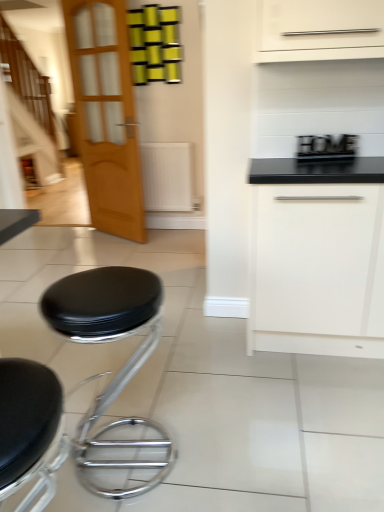
Locate an element on the screen. light brown wooden door at left is located at coordinates coord(106,115).

What do you see at coordinates (106, 115) in the screenshot? I see `light brown wooden door at left` at bounding box center [106, 115].

At what (x,y) coordinates should I click in order to perform the action: click on black leather stool at lower left, the second stool from the front. Please return your answer as a coordinate pair (x, y). Image resolution: width=384 pixels, height=512 pixels. Looking at the image, I should click on (121, 369).

Measure the distance between point (94, 343) and camera.

The distance of point (94, 343) from camera is 2.16 meters.

This screenshot has width=384, height=512. I want to click on black leather stool at lower left, the first stool when ordered from front to back, so click(30, 429).

What do you see at coordinates (326, 149) in the screenshot? I see `wooden sign at upper right` at bounding box center [326, 149].

Locate an element on the screen. wooden staircase at left is located at coordinates (28, 83).

At what (x,y) coordinates should I click in order to perform the action: click on light brown wooden door at left. Please return your answer as a coordinate pair (x, y). This screenshot has height=512, width=384. Looking at the image, I should click on (106, 115).

Is wooden sign at upper right oriented away from black leather stool at lower left, the second stool from the front?

wooden sign at upper right does not have its back to black leather stool at lower left, the second stool from the front.

Can you confirm if wooden sign at upper right is taller than black leather stool at lower left, the second stool from the front?

Incorrect, the height of wooden sign at upper right is not larger of that of black leather stool at lower left, the second stool from the front.

From the picture: Does wooden sign at upper right appear on the left side of black leather stool at lower left, the second stool from the front?

No, wooden sign at upper right is not to the left of black leather stool at lower left, the second stool from the front.

Which is behind, point (335, 152) or point (88, 424)?

The point (335, 152) is behind.

Is wooden staircase at left inside white matte drawer at center right?

No.

Find the location of a particular element. This screenshot has width=384, height=512. stairwell above the white matte drawer at center right (from the image's perspective) is located at coordinates [28, 83].

Does point (341, 308) come closer to viewer compared to point (39, 114)?

Yes, it is.

In the scene shown: Considering the positions of objects white matte drawer at center right and wooden staircase at left in the image provided, who is behind, white matte drawer at center right or wooden staircase at left?

wooden staircase at left is more distant.

How different are the orientations of wooden staircase at left and white matte drawer at center right in degrees?

0.0779 degrees.

Does wooden staircase at left contain white matte drawer at center right?

Definitely not — white matte drawer at center right is not inside wooden staircase at left.

Considering the positions of point (42, 92) and point (368, 320), is point (42, 92) closer or farther from the camera than point (368, 320)?

Point (42, 92) is positioned farther from the camera compared to point (368, 320).

Are wooden staircase at left and white matte drawer at center right located far from each other?

wooden staircase at left is positioned a significant distance from white matte drawer at center right.

Is white matte drawer at center right at the right side of black leather stool at lower left, arranged as the 2th stool when viewed from the back?

Indeed, white matte drawer at center right is positioned on the right side of black leather stool at lower left, arranged as the 2th stool when viewed from the back.

Based on the photo, would you consider white matte drawer at center right to be distant from black leather stool at lower left, arranged as the 2th stool when viewed from the back?

Yes, white matte drawer at center right is far from black leather stool at lower left, arranged as the 2th stool when viewed from the back.

From a real-world perspective, is white matte drawer at center right physically located above or below black leather stool at lower left, arranged as the 2th stool when viewed from the back?

From a real-world perspective, white matte drawer at center right is physically above black leather stool at lower left, arranged as the 2th stool when viewed from the back.

Looking at this image, from a real-world perspective, is black leather stool at lower left, the 1th stool viewed from the back, beneath wooden sign at upper right?

Yes, from a real-world perspective, black leather stool at lower left, the 1th stool viewed from the back, is under wooden sign at upper right.

Where is `appliance positioned vertically above the black leather stool at lower left, the 1th stool viewed from the back (from a real-world perspective)`? appliance positioned vertically above the black leather stool at lower left, the 1th stool viewed from the back (from a real-world perspective) is located at coordinates (326, 149).

Considering the points (119, 281) and (352, 144), which point is in front, point (119, 281) or point (352, 144)?

Point (119, 281)

Who is taller, black leather stool at lower left, the second stool from the front, or wooden sign at upper right?

black leather stool at lower left, the second stool from the front.

In terms of size, does black leather stool at lower left, arranged as the 2th stool when viewed from the back, appear bigger or smaller than wooden sign at upper right?

In the image, black leather stool at lower left, arranged as the 2th stool when viewed from the back, appears to be larger than wooden sign at upper right.

Is black leather stool at lower left, arranged as the 2th stool when viewed from the back, aimed at wooden sign at upper right?

No.

Which is in front, point (19, 467) or point (333, 152)?

The point (19, 467) is closer to the camera.

Would you say black leather stool at lower left, arranged as the 2th stool when viewed from the back, is inside or outside wooden sign at upper right?

black leather stool at lower left, arranged as the 2th stool when viewed from the back, is spatially situated outside wooden sign at upper right.

Can you confirm if wooden sign at upper right is taller than white matte drawer at center right?

In fact, wooden sign at upper right may be shorter than white matte drawer at center right.

Looking at this image, from a real-world perspective, who is located lower, wooden sign at upper right or white matte drawer at center right?

white matte drawer at center right is physically lower.

Which object is positioned more to the right, wooden sign at upper right or white matte drawer at center right?

From the viewer's perspective, white matte drawer at center right appears more on the right side.

Where is `stool that is the 1st one when counting leftward from the wooden sign at upper right`? stool that is the 1st one when counting leftward from the wooden sign at upper right is located at coordinates (121, 369).

Locate an element on the screen. The width and height of the screenshot is (384, 512). stairwell that is above the white matte drawer at center right (from a real-world perspective) is located at coordinates (28, 83).

Considering their positions, is wooden sign at upper right positioned closer to white matte drawer at center right than black leather stool at lower left, the first stool when ordered from front to back?

wooden sign at upper right lies closer to white matte drawer at center right than the other object.

Based on their spatial positions, is wooden sign at upper right or wooden staircase at left further from black leather stool at lower left, the second stool from the front?

wooden staircase at left.

From the image, which object appears to be farther from black leather stool at lower left, arranged as the 2th stool when viewed from the back, wooden sign at upper right or white matte drawer at center right?

Among the two, wooden sign at upper right is located further to black leather stool at lower left, arranged as the 2th stool when viewed from the back.

Based on their spatial positions, is black leather stool at lower left, the first stool when ordered from front to back, or light brown wooden door at left further from wooden staircase at left?

Based on the image, black leather stool at lower left, the first stool when ordered from front to back, appears to be further to wooden staircase at left.

Looking at this image, based on their spatial positions, is black leather stool at lower left, arranged as the 2th stool when viewed from the back, or black leather stool at lower left, the second stool from the front, closer to wooden sign at upper right?

Based on the image, black leather stool at lower left, the second stool from the front, appears to be nearer to wooden sign at upper right.

Estimate the real-world distances between objects in this image. Which object is closer to wooden sign at upper right, black leather stool at lower left, the second stool from the front, or black leather stool at lower left, arranged as the 2th stool when viewed from the back?

black leather stool at lower left, the second stool from the front, lies closer to wooden sign at upper right than the other object.

Looking at the image, which one is located further to white matte drawer at center right, black leather stool at lower left, the first stool when ordered from front to back, or wooden staircase at left?

wooden staircase at left is further to white matte drawer at center right.

Which object lies nearer to the anchor point black leather stool at lower left, the first stool when ordered from front to back, wooden sign at upper right or black leather stool at lower left, the 1th stool viewed from the back?

black leather stool at lower left, the 1th stool viewed from the back, lies closer to black leather stool at lower left, the first stool when ordered from front to back, than the other object.

Find the location of a particular element. appliance between black leather stool at lower left, the 1th stool viewed from the back, and white matte drawer at center right, in the horizontal direction is located at coordinates (326, 149).

Where is `door between wooden staircase at left and white matte drawer at center right in the horizontal direction`? door between wooden staircase at left and white matte drawer at center right in the horizontal direction is located at coordinates point(106,115).

Where is `drawer located between black leather stool at lower left, the 1th stool viewed from the back, and wooden staircase at left in the depth direction`? The height and width of the screenshot is (512, 384). drawer located between black leather stool at lower left, the 1th stool viewed from the back, and wooden staircase at left in the depth direction is located at coordinates (320, 259).

The width and height of the screenshot is (384, 512). Identify the location of appliance between black leather stool at lower left, the first stool when ordered from front to back, and wooden staircase at left in the front-back direction. (x=326, y=149).